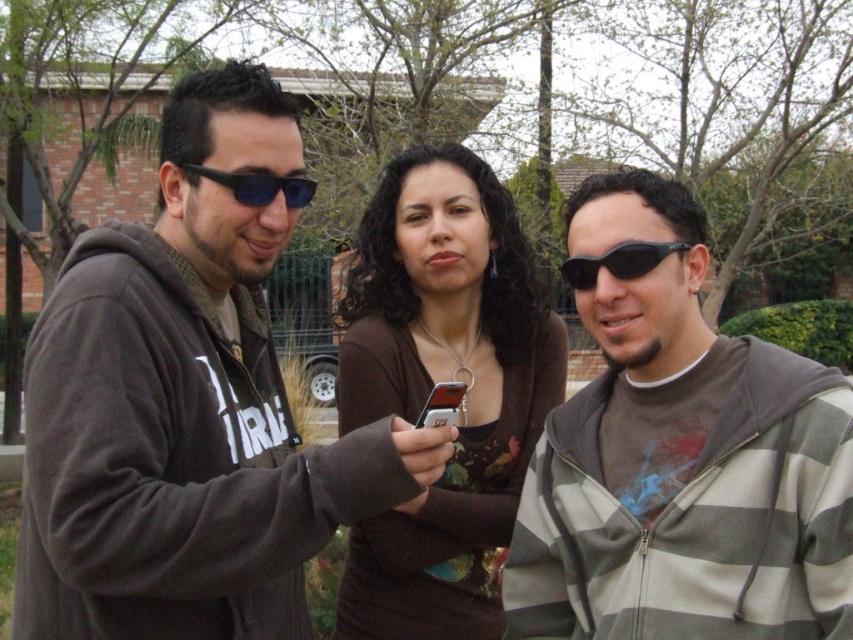
From the picture: Is dark gray hoodie at center closer to the viewer compared to black plastic sunglasses at center?

Yes, dark gray hoodie at center is in front of black plastic sunglasses at center.

Which of these two, dark gray hoodie at center or black plastic sunglasses at center, stands shorter?

black plastic sunglasses at center

The image size is (853, 640). I want to click on dark gray hoodie at center, so click(187, 408).

Image resolution: width=853 pixels, height=640 pixels. I want to click on dark gray hoodie at center, so click(x=187, y=408).

At what (x,y) coordinates should I click in order to perform the action: click on dark gray hoodie at center. Please return your answer as a coordinate pair (x, y). This screenshot has height=640, width=853. Looking at the image, I should click on (187, 408).

Does dark gray hoodie at center have a smaller size compared to matte brown sweater at center?

Incorrect, dark gray hoodie at center is not smaller in size than matte brown sweater at center.

Is point (215, 145) farther from camera compared to point (363, 614)?

No, it is not.

I want to click on dark gray hoodie at center, so click(187, 408).

Does black plastic sunglasses at center appear on the right side of matte black sunglasses at left?

Correct, you'll find black plastic sunglasses at center to the right of matte black sunglasses at left.

Which is below, black plastic sunglasses at center or matte black sunglasses at left?

black plastic sunglasses at center is below.

Describe the element at coordinates (618, 262) in the screenshot. The height and width of the screenshot is (640, 853). I see `black plastic sunglasses at center` at that location.

The image size is (853, 640). What are the coordinates of `black plastic sunglasses at center` in the screenshot? It's located at (618, 262).